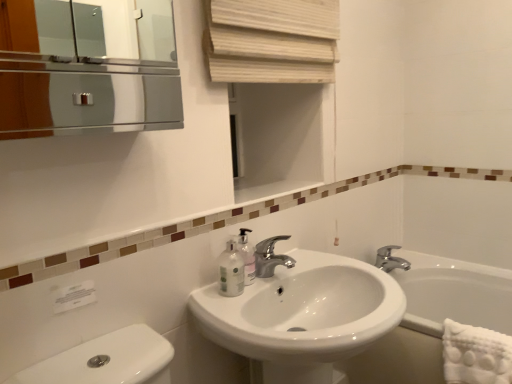
What do you see at coordinates (271, 40) in the screenshot?
I see `natural wood blinds at upper center` at bounding box center [271, 40].

The image size is (512, 384). What do you see at coordinates (231, 271) in the screenshot? I see `translucent plastic mouthwash at lower center` at bounding box center [231, 271].

Identify the location of translucent plastic soap dispenser at sink. (247, 256).

Describe the element at coordinates (476, 354) in the screenshot. I see `white textured towel at lower right` at that location.

Find the location of a particular element. This screenshot has height=384, width=512. silver metallic faucet at center, the 2th tap viewed from the left is located at coordinates (390, 260).

This screenshot has height=384, width=512. What are the coordinates of `natural wood blinds at upper center` in the screenshot? It's located at (271, 40).

Is natural wood blinds at upper center not within white glossy sink at center?

Yes, natural wood blinds at upper center is located beyond the bounds of white glossy sink at center.

Can you confirm if natural wood blinds at upper center is shorter than white glossy sink at center?

Indeed, natural wood blinds at upper center has a lesser height compared to white glossy sink at center.

Is natural wood blinds at upper center facing away from white glossy sink at center?

natural wood blinds at upper center is not turned away from white glossy sink at center.

From the image's perspective, is natural wood blinds at upper center above white glossy sink at center?

Correct, natural wood blinds at upper center appears higher than white glossy sink at center in the image.

From a real-world perspective, is translucent plastic mouthwash at lower center on natural wood blinds at upper center?

No.

Is translucent plastic mouthwash at lower center wider than natural wood blinds at upper center?

Yes.

Considering the points (234, 251) and (290, 40), which point is in front, point (234, 251) or point (290, 40)?

Point (234, 251)

In terms of height, does translucent plastic mouthwash at lower center look taller or shorter compared to natural wood blinds at upper center?

In the image, translucent plastic mouthwash at lower center appears to be shorter than natural wood blinds at upper center.

From the image's perspective, which is below, translucent plastic mouthwash at lower center or white ceramic bathtub at lower right?

white ceramic bathtub at lower right is shown below in the image.

The width and height of the screenshot is (512, 384). Find the location of `mouthwash in front of the white ceramic bathtub at lower right`. mouthwash in front of the white ceramic bathtub at lower right is located at coordinates (231, 271).

Is white ceramic bathtub at lower right a part of translucent plastic mouthwash at lower center?

No, white ceramic bathtub at lower right is not inside translucent plastic mouthwash at lower center.

From a real-world perspective, is white textured towel at lower right positioned above or below silver metallic faucet at center, positioned as the 1th tap in right-to-left order?

white textured towel at lower right is situated lower than silver metallic faucet at center, positioned as the 1th tap in right-to-left order, in the real world.

From the image's perspective, does white textured towel at lower right appear higher than silver metallic faucet at center, positioned as the 1th tap in right-to-left order?

No, from the image's perspective, white textured towel at lower right is not above silver metallic faucet at center, positioned as the 1th tap in right-to-left order.

Considering the relative positions of white textured towel at lower right and silver metallic faucet at center, the 2th tap viewed from the left, in the image provided, is white textured towel at lower right to the right of silver metallic faucet at center, the 2th tap viewed from the left, from the viewer's perspective?

Yes.

Would you say silver metallic faucet at center, the 2th tap viewed from the left, is part of white textured towel at lower right's contents?

No, silver metallic faucet at center, the 2th tap viewed from the left, is not surrounded by white textured towel at lower right.

Is polished chrome faucet at center, the first tap positioned from the left, looking in the opposite direction of white ceramic bathtub at lower right?

No, polished chrome faucet at center, the first tap positioned from the left, is not facing the opposite direction of white ceramic bathtub at lower right.

From the image's perspective, which is above, polished chrome faucet at center, the first tap positioned from the left, or white ceramic bathtub at lower right?

polished chrome faucet at center, the first tap positioned from the left, appears higher in the image.

Is polished chrome faucet at center, the first tap positioned from the left, far from white ceramic bathtub at lower right?

polished chrome faucet at center, the first tap positioned from the left, is near white ceramic bathtub at lower right, not far away.

At what (x,y) coordinates should I click in order to perform the action: click on the 2nd tap above the white ceramic bathtub at lower right (from the image's perspective). Please return your answer as a coordinate pair (x, y). The width and height of the screenshot is (512, 384). Looking at the image, I should click on (270, 257).

Is white textured towel at lower right at the back of translucent plastic soap dispenser at sink?

No, translucent plastic soap dispenser at sink's orientation is not away from white textured towel at lower right.

Choose the correct answer: Is translucent plastic soap dispenser at sink inside white textured towel at lower right or outside it?

translucent plastic soap dispenser at sink exists outside the volume of white textured towel at lower right.

Looking at this image, considering the relative positions of translucent plastic soap dispenser at sink and white textured towel at lower right in the image provided, is translucent plastic soap dispenser at sink to the right of white textured towel at lower right from the viewer's perspective?

Incorrect, translucent plastic soap dispenser at sink is not on the right side of white textured towel at lower right.

Image resolution: width=512 pixels, height=384 pixels. Find the location of `bath towel that is below the translucent plastic soap dispenser at sink (from the image's perspective)`. bath towel that is below the translucent plastic soap dispenser at sink (from the image's perspective) is located at coordinates (476, 354).

From a real-world perspective, is white textured towel at lower right physically below translucent plastic mouthwash at lower center?

Correct, in the physical world, white textured towel at lower right is lower than translucent plastic mouthwash at lower center.

Is white textured towel at lower right positioned far away from translucent plastic mouthwash at lower center?

white textured towel at lower right is actually quite close to translucent plastic mouthwash at lower center.

Considering the sizes of objects white textured towel at lower right and translucent plastic mouthwash at lower center in the image provided, who is bigger, white textured towel at lower right or translucent plastic mouthwash at lower center?

white textured towel at lower right.

In terms of width, does white textured towel at lower right look wider or thinner when compared to translucent plastic mouthwash at lower center?

Considering their sizes, white textured towel at lower right looks broader than translucent plastic mouthwash at lower center.

This screenshot has width=512, height=384. I want to click on curtain above the white glossy sink at center (from a real-world perspective), so click(x=271, y=40).

The width and height of the screenshot is (512, 384). What are the coordinates of `curtain that appears above the translucent plastic mouthwash at lower center (from the image's perspective)` in the screenshot? It's located at (271, 40).

Which object lies nearer to the anchor point silver metallic faucet at center, the 2th tap viewed from the left, natural wood blinds at upper center or white ceramic bathtub at lower right?

The object closer to silver metallic faucet at center, the 2th tap viewed from the left, is white ceramic bathtub at lower right.

Considering their positions, is polished chrome faucet at center, the second tap positioned from the right, positioned closer to white ceramic bathtub at lower right than white glossy sink at center?

white glossy sink at center lies closer to white ceramic bathtub at lower right than the other object.

From the image, which object appears to be nearer to translucent plastic mouthwash at lower center, white glossy sink at center or white textured towel at lower right?

white glossy sink at center.

From the image, which object appears to be farther from polished chrome faucet at center, the second tap positioned from the right, white ceramic bathtub at lower right or white textured towel at lower right?

white ceramic bathtub at lower right.

When comparing their distances from silver metallic faucet at center, the 2th tap when ordered from front to back, does translucent plastic mouthwash at lower center or white textured towel at lower right seem further?

Based on the image, translucent plastic mouthwash at lower center appears to be further to silver metallic faucet at center, the 2th tap when ordered from front to back.

From the image, which object appears to be farther from translucent plastic mouthwash at lower center, polished chrome faucet at center, the second tap positioned from the right, or natural wood blinds at upper center?

Based on the image, natural wood blinds at upper center appears to be further to translucent plastic mouthwash at lower center.

From the image, which object appears to be farther from white textured towel at lower right, white ceramic bathtub at lower right or translucent plastic mouthwash at lower center?

The object further to white textured towel at lower right is translucent plastic mouthwash at lower center.

Estimate the real-world distances between objects in this image. Which object is further from white textured towel at lower right, white glossy sink at center or natural wood blinds at upper center?

Among the two, natural wood blinds at upper center is located further to white textured towel at lower right.

Locate an element on the screen. soap dispenser between translucent plastic mouthwash at lower center and white textured towel at lower right is located at coordinates (247, 256).

Image resolution: width=512 pixels, height=384 pixels. In order to click on sink situated between polished chrome faucet at center, the first tap positioned from the left, and white ceramic bathtub at lower right from left to right in this screenshot , I will do `click(300, 313)`.

Find the location of a particular element. The height and width of the screenshot is (384, 512). bath towel positioned between white glossy sink at center and silver metallic faucet at center, the 2th tap when ordered from front to back, from near to far is located at coordinates (476, 354).

Identify the location of tap between translucent plastic soap dispenser at sink and silver metallic faucet at center, the 1th tap in the back-to-front sequence. The image size is (512, 384). (270, 257).